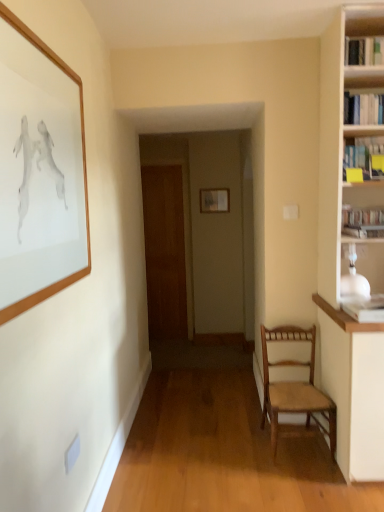
What are the coordinates of `free space above hardcover book at upper right, which is counted as the 3th book, starting from the bottom (from a real-world perspective)` in the screenshot? It's located at (370, 83).